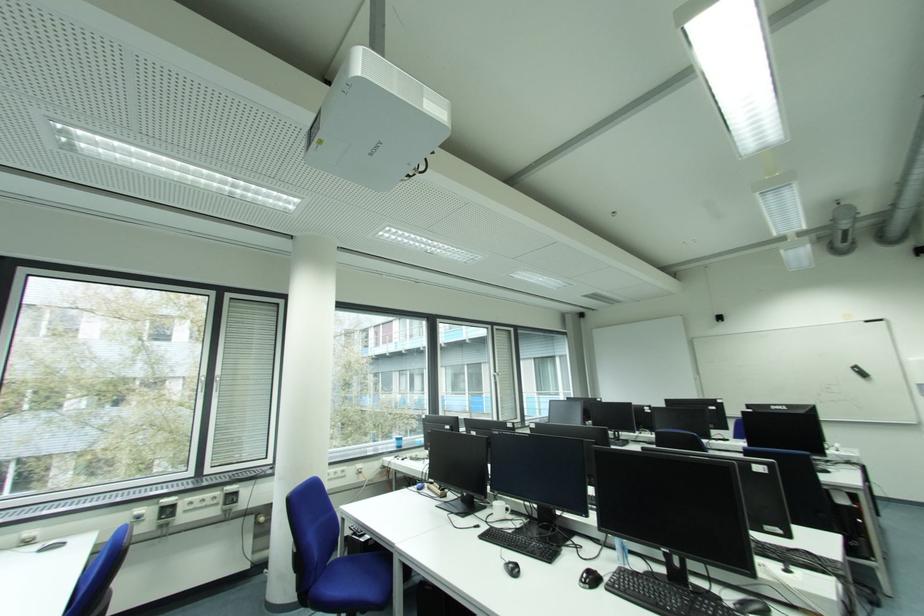
Find where to lift the white mug handle. Please return your answer as a coordinate pair (x, y).

(500, 509)